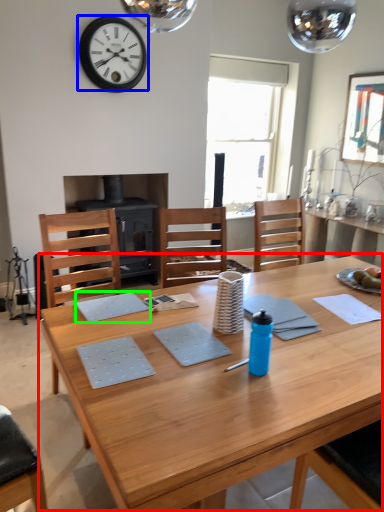
Question: Based on their relative distances, which object is nearer to table (highlighted by a red box)? Choose from wall clock (highlighted by a blue box) and place mat (highlighted by a green box).

Choices:
 (A) wall clock
 (B) place mat

Answer: (B)